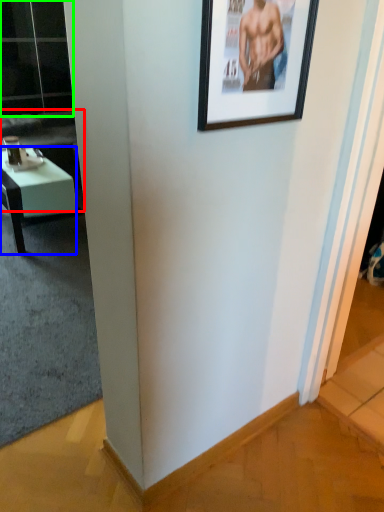
Question: Which is nearer to the couch (highlighted by a red box)? desk (highlighted by a blue box) or glass door (highlighted by a green box).

Choices:
 (A) desk
 (B) glass door

Answer: (B)